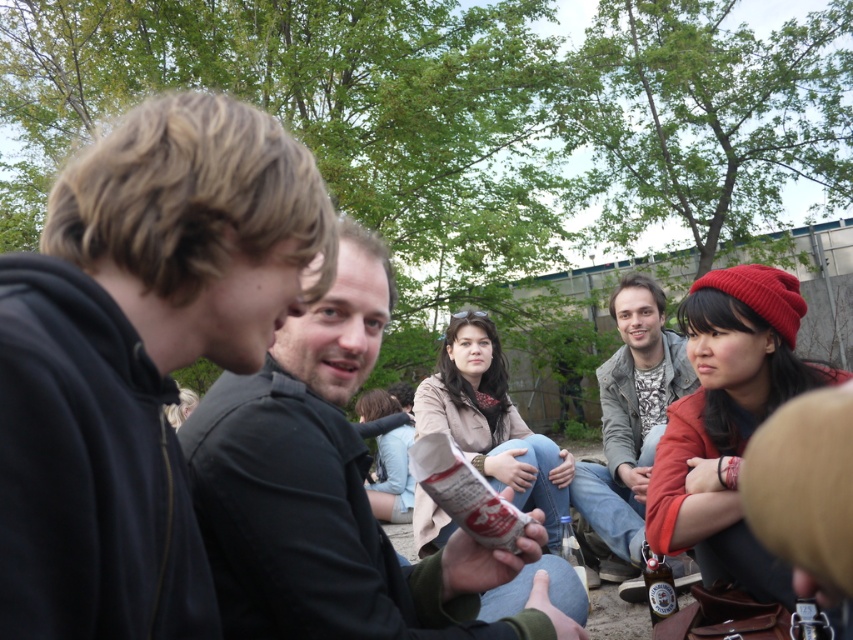
You are a photographer wanting to take a photo of the dark gray shirt at center. You have a camera that has a minimum focusing distance of 5 feet. Can you take the photo without moving either the camera or the subject?

The dark gray shirt at center and camera are 5.02 feet apart, which is slightly more than the minimum focusing distance of 5 feet. Therefore, you can take the photo without moving either the camera or the subject.

You are organizing a photo shoot and need to arrange the subjects based on their clothing size. Given the black matte jacket at left and the dark gray shirt at center, which clothing item should be placed in a larger area to accommodate its size?

The dark gray shirt at center requires a larger area since it occupies more space than the black matte jacket at left.